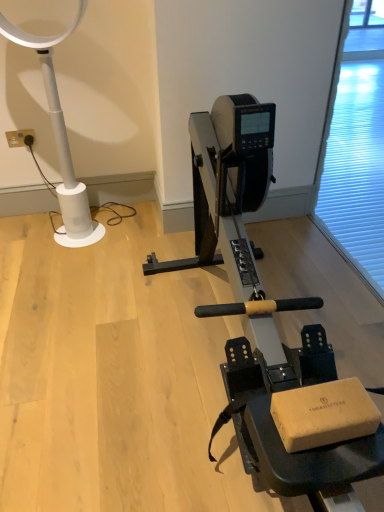
At what (x,y) coordinates should I click in order to perform the action: click on free spot in front of white plastic lamp at left. Please return your answer as a coordinate pair (x, y). The height and width of the screenshot is (512, 384). Looking at the image, I should click on (76, 265).